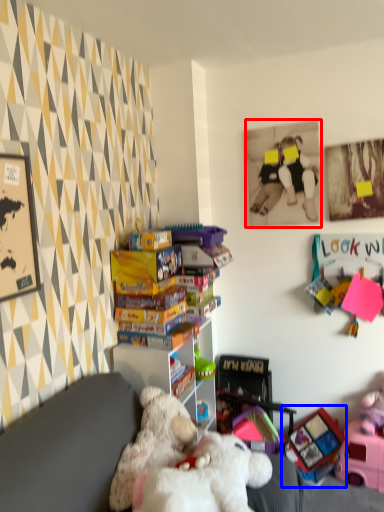
Question: Which object is closer to the camera taking this photo, picture frame (highlighted by a red box) or toy (highlighted by a blue box)?

Choices:
 (A) picture frame
 (B) toy

Answer: (A)